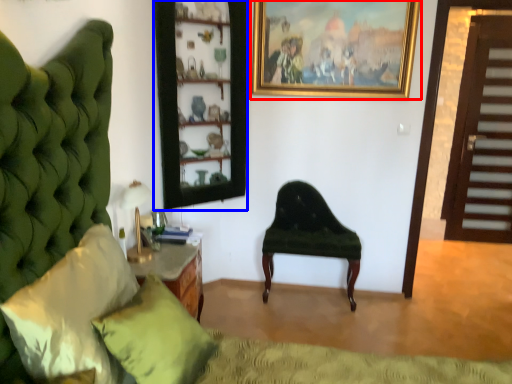
Question: Which of the following is the closest to the observer, picture frame (highlighted by a red box) or shelf (highlighted by a blue box)?

Choices:
 (A) picture frame
 (B) shelf

Answer: (B)